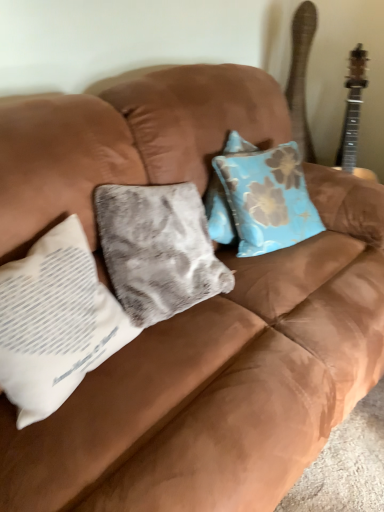
Question: Is white fabric pillow at left taller than wooden acoustic guitar at upper right?

Choices:
 (A) no
 (B) yes

Answer: (A)

Question: Is the surface of white fabric pillow at left in direct contact with wooden acoustic guitar at upper right?

Choices:
 (A) no
 (B) yes

Answer: (A)

Question: Does white fabric pillow at left have a smaller size compared to wooden acoustic guitar at upper right?

Choices:
 (A) no
 (B) yes

Answer: (A)

Question: Is white fabric pillow at left positioned with its back to wooden acoustic guitar at upper right?

Choices:
 (A) no
 (B) yes

Answer: (A)

Question: Is white fabric pillow at left positioned in front of wooden acoustic guitar at upper right?

Choices:
 (A) no
 (B) yes

Answer: (B)

Question: Is white fabric pillow at left not close to wooden acoustic guitar at upper right?

Choices:
 (A) yes
 (B) no

Answer: (A)

Question: Is wooden acoustic guitar at upper right outside white fabric pillow at left?

Choices:
 (A) no
 (B) yes

Answer: (B)

Question: Are wooden acoustic guitar at upper right and white fabric pillow at left making contact?

Choices:
 (A) yes
 (B) no

Answer: (B)

Question: Does wooden acoustic guitar at upper right contain white fabric pillow at left?

Choices:
 (A) no
 (B) yes

Answer: (A)

Question: Does wooden acoustic guitar at upper right have a lesser width compared to white fabric pillow at left?

Choices:
 (A) yes
 (B) no

Answer: (A)

Question: Is wooden acoustic guitar at upper right further to camera compared to white fabric pillow at left?

Choices:
 (A) no
 (B) yes

Answer: (B)

Question: Considering the relative sizes of wooden acoustic guitar at upper right and white fabric pillow at left in the image provided, is wooden acoustic guitar at upper right bigger than white fabric pillow at left?

Choices:
 (A) yes
 (B) no

Answer: (B)

Question: From a real-world perspective, relative to white fabric pillow at left, is wooden acoustic guitar at upper right vertically above or below?

Choices:
 (A) above
 (B) below

Answer: (A)